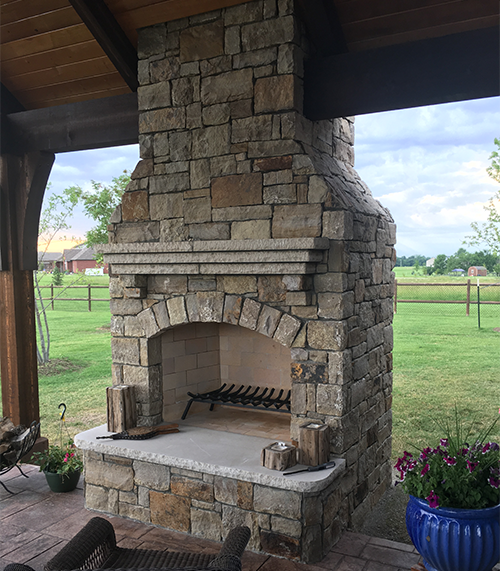
Find the location of a particular element. The height and width of the screenshot is (571, 500). light brown tiled floor is located at coordinates (48, 530).